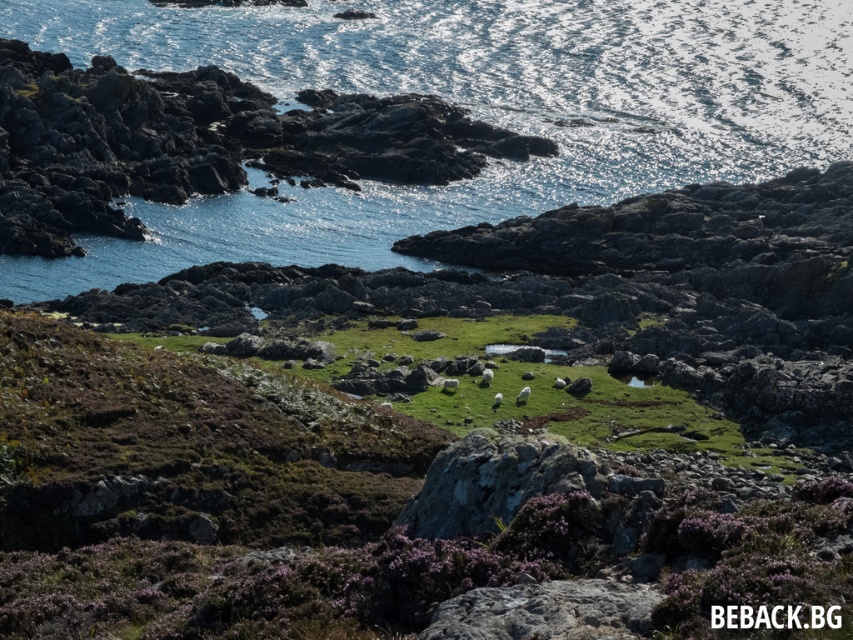
Which is above, clear water at upper center or green grass at center?

clear water at upper center

Between clear water at upper center and green grass at center, which one has less height?

green grass at center is shorter.

Find the location of a particular element. clear water at upper center is located at coordinates (469, 109).

Locate an element on the screen. The image size is (853, 640). clear water at upper center is located at coordinates (469, 109).

Which of these two, clear water at upper center or gray rough rock at lower center, stands shorter?

Standing shorter between the two is gray rough rock at lower center.

Is clear water at upper center positioned in front of gray rough rock at lower center?

No, clear water at upper center is behind gray rough rock at lower center.

Identify the location of clear water at upper center. This screenshot has width=853, height=640. (469, 109).

Does green grass at center have a lesser height compared to gray rough rock at lower center?

In fact, green grass at center may be taller than gray rough rock at lower center.

At what (x,y) coordinates should I click in order to perform the action: click on green grass at center. Please return your answer as a coordinate pair (x, y). The height and width of the screenshot is (640, 853). Looking at the image, I should click on (544, 376).

Describe the element at coordinates (544, 376) in the screenshot. The width and height of the screenshot is (853, 640). I see `green grass at center` at that location.

This screenshot has height=640, width=853. Find the location of `green grass at center`. green grass at center is located at coordinates pos(544,376).